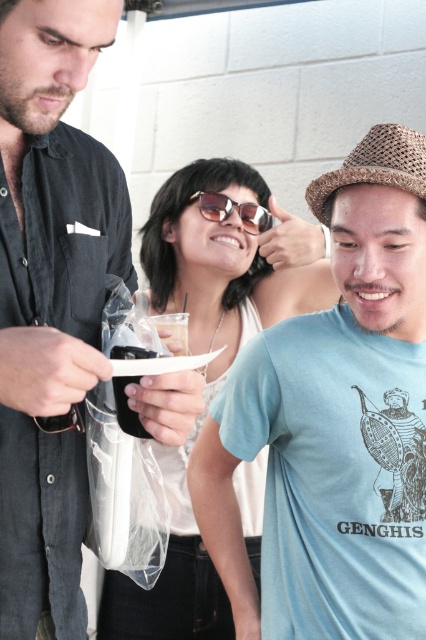
You are a photographer trying to capture a clear shot of the matte black phone at center and the sunglasses at center. Which object should you focus on first to ensure both are in focus?

The matte black phone at center is closer to the viewer than the sunglasses at center. To ensure both are in focus, you should focus on the matte black phone at center first, as it is the closer object.